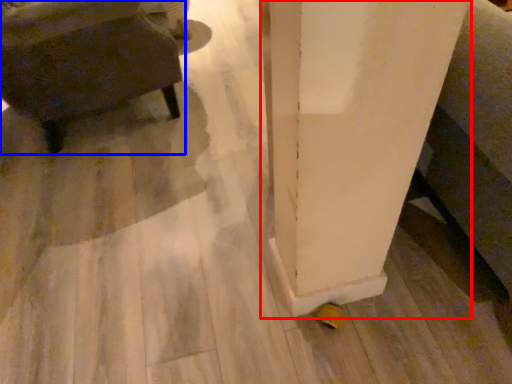
Question: Which of the following is the farthest to the observer, pillar (highlighted by a red box) or furniture (highlighted by a blue box)?

Choices:
 (A) pillar
 (B) furniture

Answer: (B)